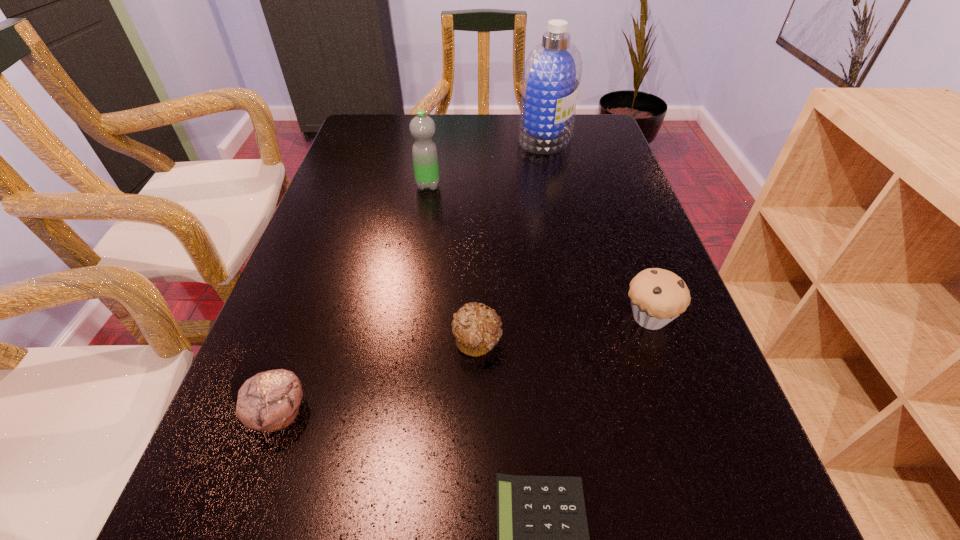
The width and height of the screenshot is (960, 540). I want to click on free location located 0.300m on the left of the tallest object, so click(420, 138).

Identify the location of vacant region located 0.130m on the left of the fifth nearest object. This screenshot has width=960, height=540. (367, 185).

This screenshot has width=960, height=540. I want to click on vacant position located 0.130m on the back of the fourth shortest object, so click(627, 254).

This screenshot has height=540, width=960. Find the location of `blank area located 0.130m on the back of the leftmost object`. blank area located 0.130m on the back of the leftmost object is located at coordinates (309, 327).

Image resolution: width=960 pixels, height=540 pixels. I want to click on vacant region located on the left of the second muffin from left to right, so click(311, 341).

You are a GUI agent. You are given a task and a screenshot of the screen. Output one action in this format:
    pyautogui.click(x=<x>, y=<y>)
    Task: Click on the object that is positioned at the far edge
    
    Given the screenshot: What is the action you would take?
    pyautogui.click(x=552, y=72)

Image resolution: width=960 pixels, height=540 pixels. I want to click on object positioned at the left edge, so click(x=269, y=401).

Where is `cleansing agent located at the right edge`? cleansing agent located at the right edge is located at coordinates (552, 72).

Locate an element on the screen. The height and width of the screenshot is (540, 960). muffin that is at the right edge is located at coordinates (658, 296).

Identify the location of object that is at the far right corner. (552, 72).